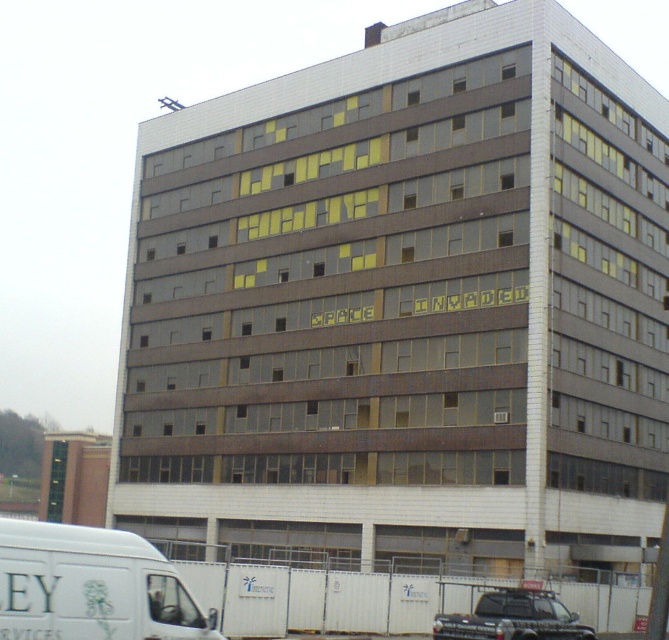
Question: Does white matte van at lower left lie behind black matte truck at lower right?

Choices:
 (A) yes
 (B) no

Answer: (B)

Question: Which point is closer to the camera taking this photo?

Choices:
 (A) (110, 627)
 (B) (472, 627)

Answer: (A)

Question: Is white matte van at lower left above black matte truck at lower right?

Choices:
 (A) no
 (B) yes

Answer: (B)

Question: In this image, where is white matte van at lower left located relative to black matte truck at lower right?

Choices:
 (A) left
 (B) right

Answer: (A)

Question: Which of the following is the farthest from the observer?

Choices:
 (A) black matte truck at lower right
 (B) white matte van at lower left

Answer: (A)